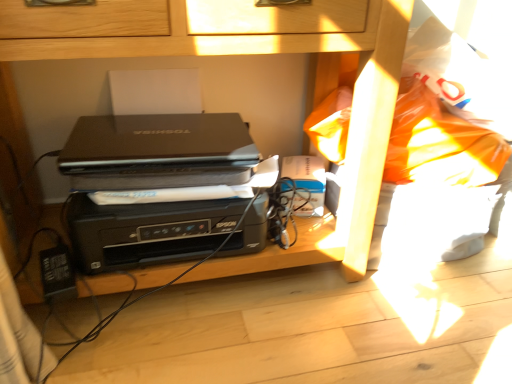
Question: From a real-world perspective, is matte black laptop at center physically located above or below black plastic printer at center?

Choices:
 (A) below
 (B) above

Answer: (A)

Question: Do you think matte black laptop at center is within black plastic printer at center, or outside of it?

Choices:
 (A) outside
 (B) inside

Answer: (B)

Question: Which of these objects is positioned closest to the black plastic printer at center?

Choices:
 (A) black plastic printer at center
 (B) black matte laptop at center
 (C) matte black laptop at center

Answer: (A)

Question: Which object is the closest to the matte black laptop at center?

Choices:
 (A) black plastic printer at center
 (B) black matte laptop at center
 (C) black plastic printer at center

Answer: (C)